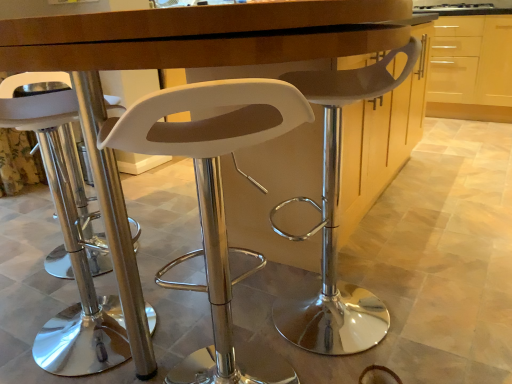
Question: From the image's perspective, relative to light wood cabinet at upper right, is white plastic stool at center, which ranks as the 2th chair in right-to-left order, above or below?

Choices:
 (A) below
 (B) above

Answer: (A)

Question: Considering the positions of white plastic stool at center, acting as the 2th chair starting from the left, and light wood cabinet at upper right in the image, is white plastic stool at center, acting as the 2th chair starting from the left, wider or thinner than light wood cabinet at upper right?

Choices:
 (A) thin
 (B) wide

Answer: (A)

Question: Estimate the real-world distances between objects in this image. Which object is closer to the light wood cabinet at upper right?

Choices:
 (A) white plastic stool at center, marked as the 1th chair in a right-to-left arrangement
 (B) white plastic stool at center, which ranks as the 2th chair in right-to-left order
 (C) white plastic stool at left, positioned as the 3th chair in right-to-left order

Answer: (A)

Question: Which is farther from the white plastic stool at center, marked as the 1th chair in a right-to-left arrangement?

Choices:
 (A) white plastic stool at center, which ranks as the 2th chair in right-to-left order
 (B) light wood cabinet at upper right
 (C) white plastic stool at left, positioned as the 3th chair in right-to-left order

Answer: (B)